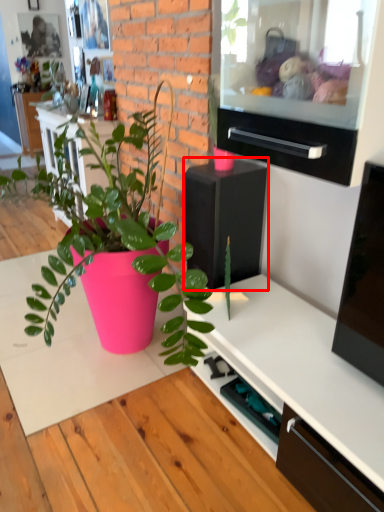
Question: Considering the relative positions of appliance (annotated by the red box) and drawer in the image provided, where is appliance (annotated by the red box) located with respect to the staircase?

Choices:
 (A) right
 (B) left

Answer: (B)